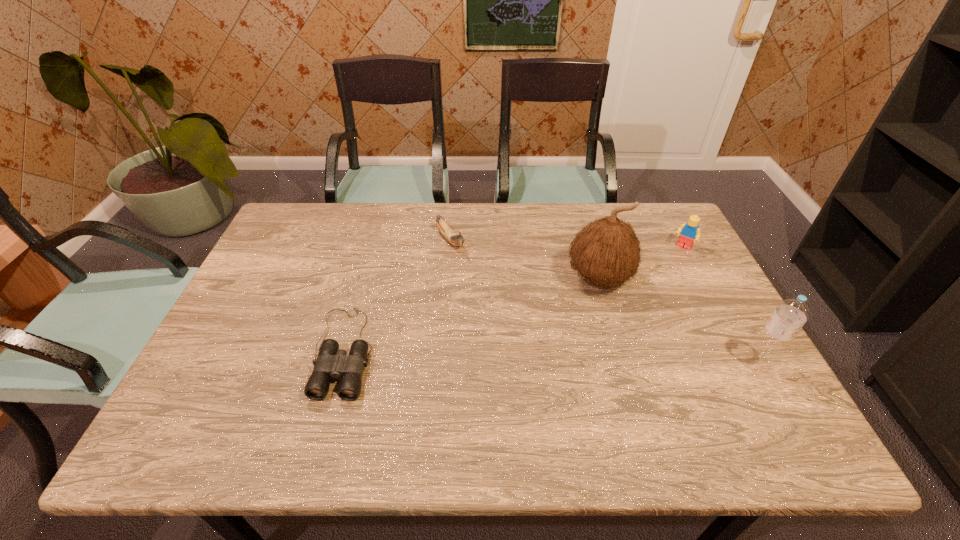
The width and height of the screenshot is (960, 540). What are the coordinates of `vacant space situated on the peel of the banana` in the screenshot? It's located at (523, 328).

Locate an element on the screen. The image size is (960, 540). vacant space situated 0.260m on the peel of the banana is located at coordinates (504, 306).

The height and width of the screenshot is (540, 960). I want to click on free space located 0.370m on the surface of the third nearest object, so click(x=501, y=387).

I want to click on blank area located on the surface of the third nearest object, so click(549, 335).

The height and width of the screenshot is (540, 960). What are the coordinates of `vacant space situated on the surface of the third nearest object` in the screenshot? It's located at (538, 347).

This screenshot has width=960, height=540. Identify the location of free space located on the front-facing side of the Lego. (661, 278).

I want to click on free spot located 0.330m on the front-facing side of the Lego, so click(x=636, y=316).

Find the location of a particular element. free location located on the front-facing side of the Lego is located at coordinates [x=666, y=270].

You are a GUI agent. You are given a task and a screenshot of the screen. Output one action in this format:
    pyautogui.click(x=<x>, y=<y>)
    Task: Click on the banana present at the far edge
    
    Given the screenshot: What is the action you would take?
    pyautogui.click(x=457, y=240)

Where is `Lego located at the far edge`? Lego located at the far edge is located at coordinates (689, 232).